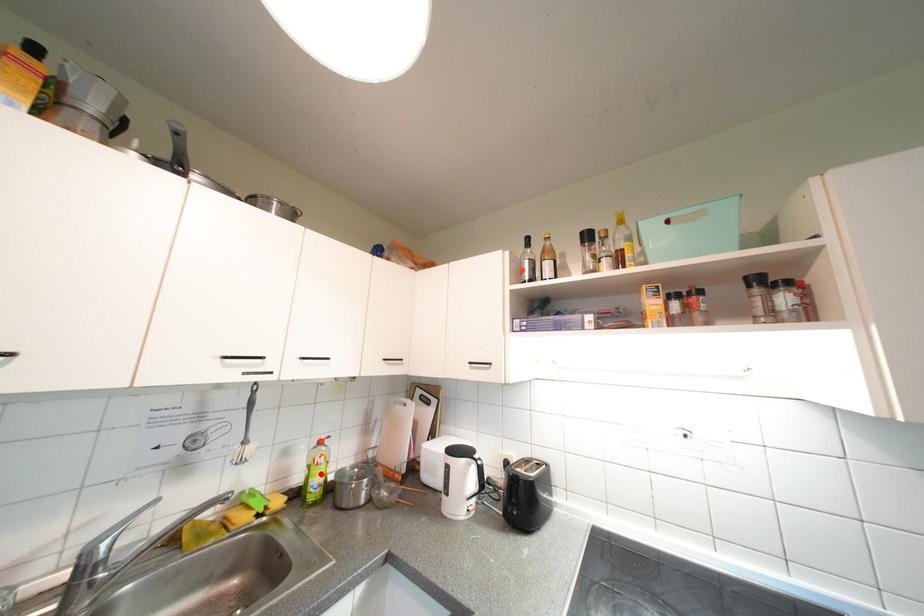
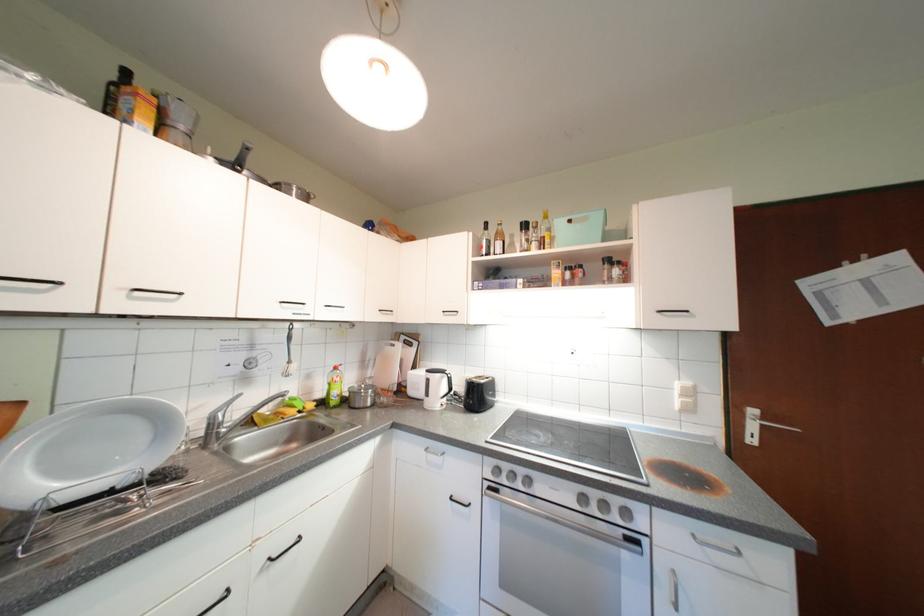
In the second image, find the point that corresponds to the highlighted location in the first image.

(341, 389)